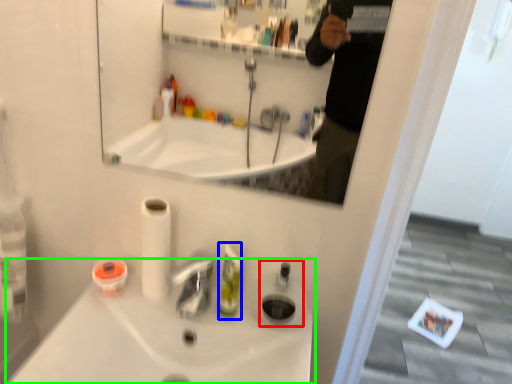
Question: Which is farther away from soap dispenser (highlighted by a red box)? mouthwash (highlighted by a blue box) or sink (highlighted by a green box)?

Choices:
 (A) mouthwash
 (B) sink

Answer: (B)